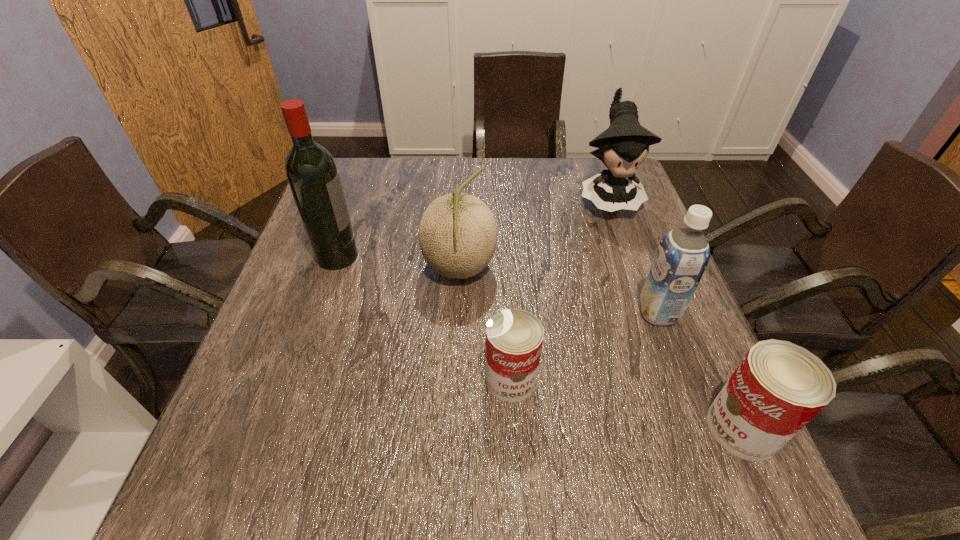
Identify the location of unoccupied position between the cantaloup and the soya milk. The image size is (960, 540). (559, 291).

Where is `vacant area that lies between the doll and the cantaloup`? This screenshot has width=960, height=540. vacant area that lies between the doll and the cantaloup is located at coordinates (534, 233).

Identify the location of free spot between the left can and the fifth tallest object. This screenshot has height=540, width=960. (627, 403).

You are a GUI agent. You are given a task and a screenshot of the screen. Output one action in this format:
    pyautogui.click(x=<x>, y=<y>)
    Task: Click on the empty space that is in between the doll and the soya milk
    
    Given the screenshot: What is the action you would take?
    pyautogui.click(x=633, y=255)

Where is `vacant point located between the cantaloup and the fifth tallest object`? The height and width of the screenshot is (540, 960). vacant point located between the cantaloup and the fifth tallest object is located at coordinates (601, 349).

You are a GUI agent. You are given a task and a screenshot of the screen. Output one action in this format:
    pyautogui.click(x=<x>, y=<y>)
    Task: Click on the vacant space in between the soya milk and the wine bottle
    
    Given the screenshot: What is the action you would take?
    pyautogui.click(x=497, y=285)

I want to click on the second closest object relative to the cantaloup, so click(311, 171).

Identify which object is located as the second nearest to the cantaloup. Please provide its 2D coordinates. Your answer should be formatted as a tuple, i.e. [(x, y)], where the tuple contains the x and y coordinates of a point satisfying the conditions above.

[(311, 171)]

Where is `free space that satisfies the following two spatial constraints: 1. on the label of the tallest object; 2. on the right side of the cantaloup`? The image size is (960, 540). free space that satisfies the following two spatial constraints: 1. on the label of the tallest object; 2. on the right side of the cantaloup is located at coordinates (332, 269).

Identify the location of blank area in the image that satisfies the following two spatial constraints: 1. on the label of the leftmost object; 2. on the right side of the cantaloup. (332, 269).